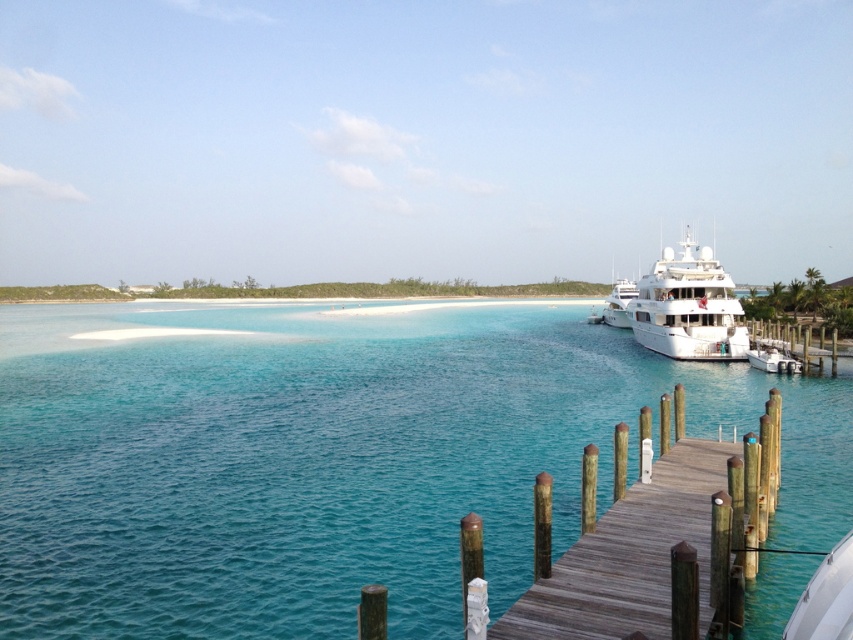
You are standing on the dock and want to take a photo of the turquoise water at center. Which direction should you point your camera to capture it?

The turquoise water at center is located at the coordinates point (335,458). To capture it, point your camera towards the center of the image where the coordinates indicate the water is positioned.

You are standing at the center of the image and want to walk towards the wooden dock at lower right. Which direction should you move in to reach it?

To reach the wooden dock at lower right, you should move towards the lower right direction since it is located at point (630,556) which is in the lower right quadrant of the image.